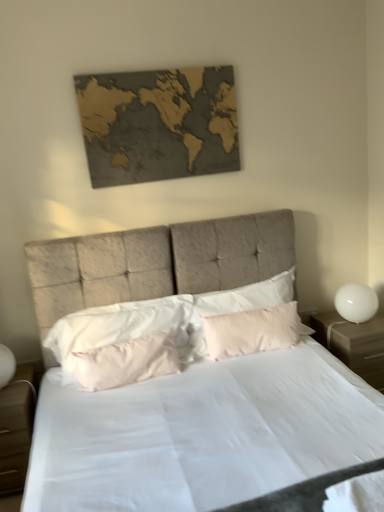
Question: Considering the positions of point (314, 317) and point (203, 154), is point (314, 317) closer or farther from the camera than point (203, 154)?

Choices:
 (A) farther
 (B) closer

Answer: (A)

Question: In terms of size, does white glossy nightstand at right, the 2th nightstand from the left, appear bigger or smaller than gold textured map at upper center?

Choices:
 (A) small
 (B) big

Answer: (B)

Question: Which is nearer to the white glossy nightstand at right, positioned as the first nightstand in right-to-left order?

Choices:
 (A) light brown wood nightstand at lower left, which appears as the 2th nightstand when viewed from the right
 (B) white glossy sphere at right
 (C) gold textured map at upper center
 (D) matte beige bed at center
 (E) pink fabric pillow at center, the 3th pillow when ordered from left to right

Answer: (B)

Question: Which object is positioned farthest from the gold textured map at upper center?

Choices:
 (A) silky white pillow at center, arranged as the 1th pillow when viewed from the left
 (B) light brown wood nightstand at lower left, which appears as the 2th nightstand when viewed from the right
 (C) white glossy sphere at right
 (D) pink satin pillow at center, the 2th pillow when ordered from right to left
 (E) pink fabric pillow at center, the 3th pillow when ordered from left to right

Answer: (B)